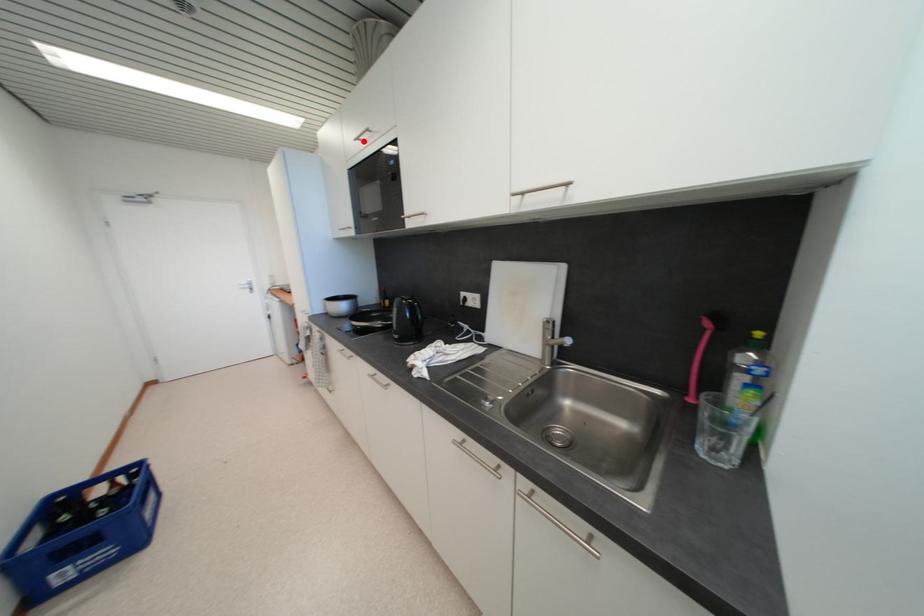
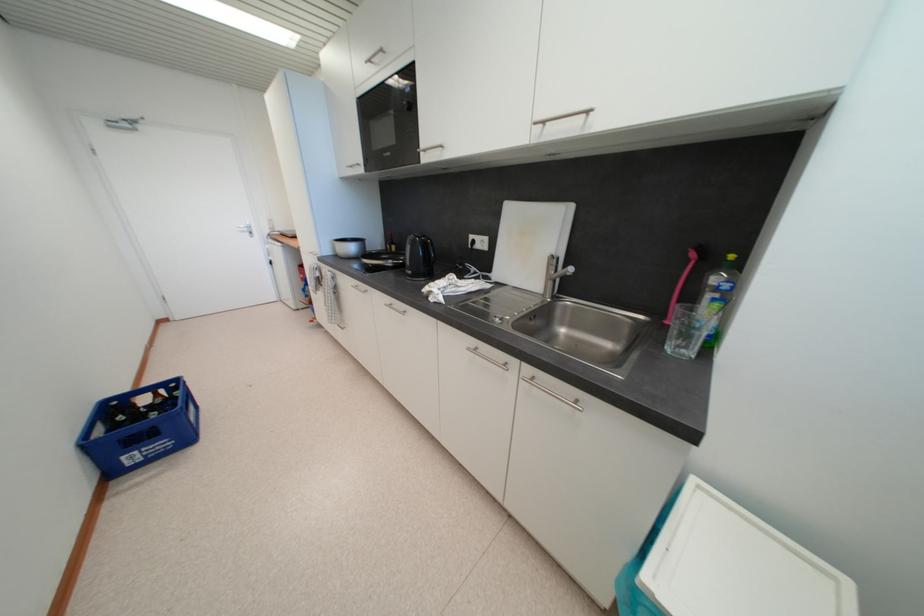
Find the pixel in the second image that matches the highlighted location in the first image.

(375, 63)